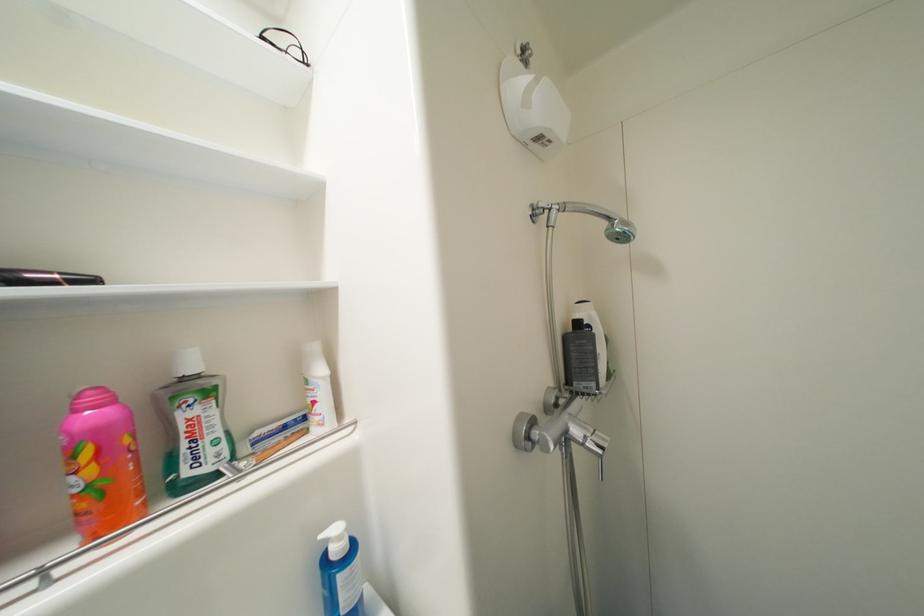
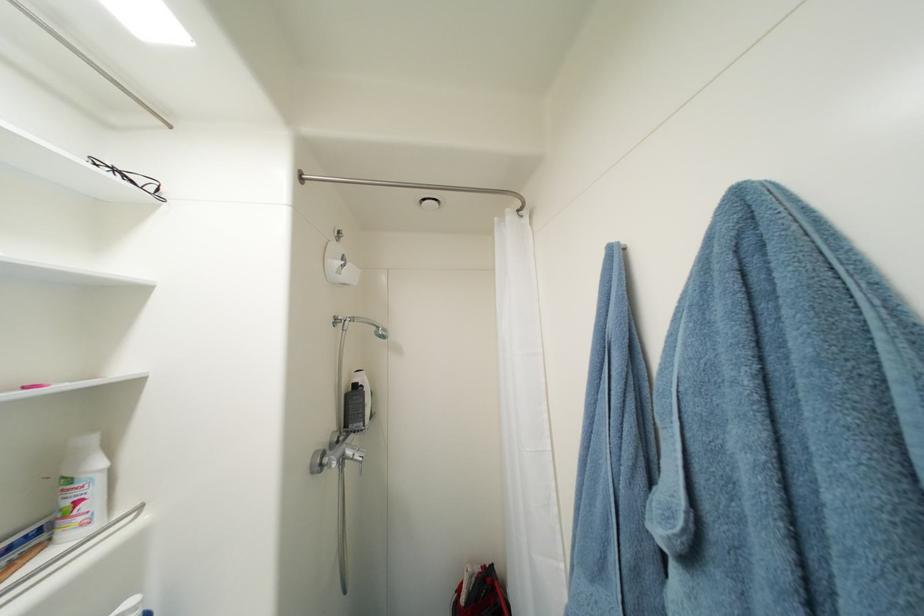
The point at (582, 434) is marked in the first image. Where is the corresponding point in the second image?

(356, 454)